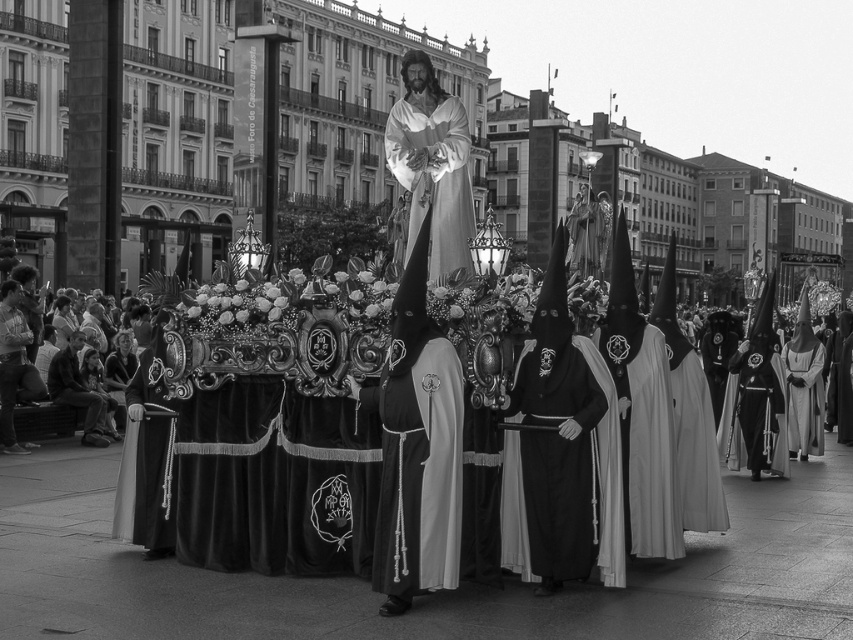
Between velvet black robe at center and smooth fabric man at lower left, which one is positioned higher?

smooth fabric man at lower left

Between velvet black robe at center and smooth fabric man at lower left, which one is positioned lower?

velvet black robe at center is lower down.

Between point (602, 548) and point (50, 380), which one is positioned in front?

Positioned in front is point (602, 548).

You are a GUI agent. You are given a task and a screenshot of the screen. Output one action in this format:
    pyautogui.click(x=<x>, y=<y>)
    Task: Click on the velvet black robe at center
    Image resolution: width=853 pixels, height=640 pixels.
    Given the screenshot: What is the action you would take?
    pyautogui.click(x=607, y=474)

Is smooth black robe at center thinner than silky white robe at center?

Indeed, smooth black robe at center has a lesser width compared to silky white robe at center.

Find the location of `smooth black robe at center`. smooth black robe at center is located at coordinates (146, 461).

The width and height of the screenshot is (853, 640). What are the coordinates of `smooth black robe at center` in the screenshot? It's located at (146, 461).

From the picture: Does silky white robe at center have a lesser height compared to smooth skin face at lower left?

In fact, silky white robe at center may be taller than smooth skin face at lower left.

Where is `silky white robe at center`? silky white robe at center is located at coordinates (583, 234).

Image resolution: width=853 pixels, height=640 pixels. I want to click on silky white robe at center, so click(x=583, y=234).